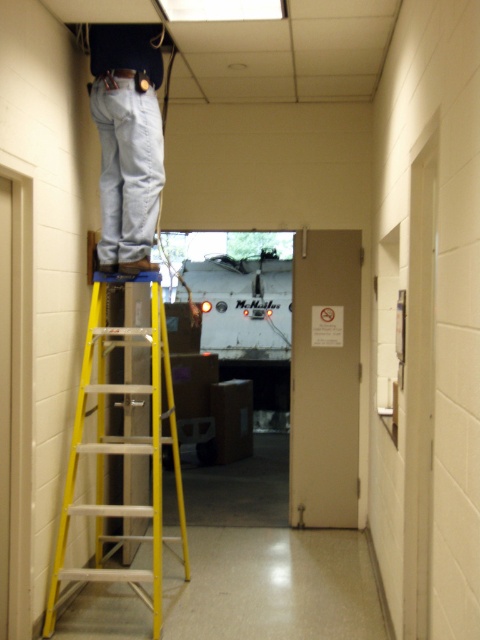
Is point (52, 564) positioned in front of point (105, 253)?

Yes.

Is yellow aluminum ladder at center shorter than denim pants at upper center?

In fact, yellow aluminum ladder at center may be taller than denim pants at upper center.

Locate an element on the screen. yellow aluminum ladder at center is located at coordinates (122, 449).